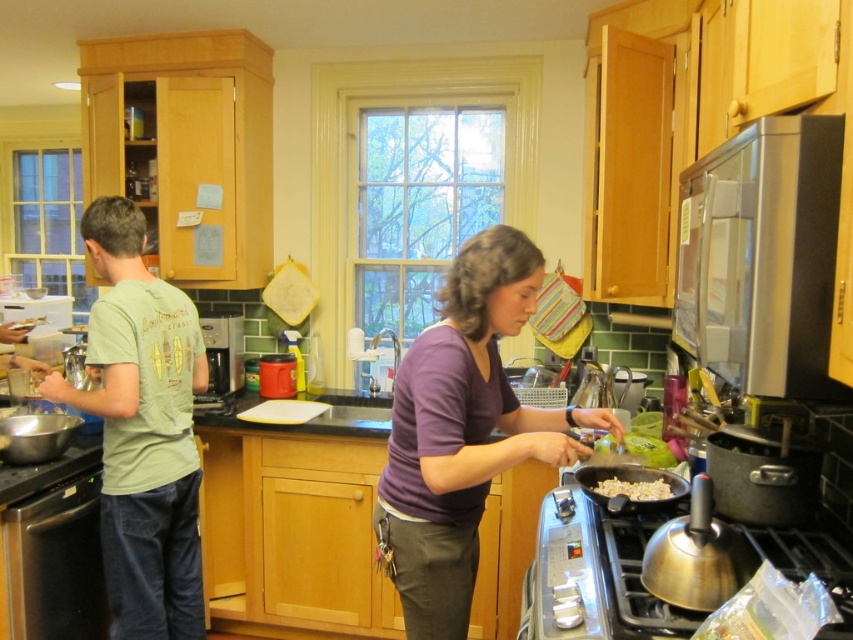
Question: Which object appears farthest from the camera in this image?

Choices:
 (A) brown matte pan at lower center
 (B) green cotton shirt at left
 (C) stainless steel stove at lower right
 (D) purple matte shirt at center

Answer: (B)

Question: Which point is closer to the camera?

Choices:
 (A) (485, 314)
 (B) (589, 602)

Answer: (B)

Question: Is green cotton shirt at left to the right of brown matte pan at lower center from the viewer's perspective?

Choices:
 (A) yes
 (B) no

Answer: (B)

Question: Is satin black dishwasher at lower left below brown matte pan at lower center?

Choices:
 (A) yes
 (B) no

Answer: (A)

Question: Which of the following is the farthest from the observer?

Choices:
 (A) brown matte pan at lower center
 (B) purple matte shirt at center

Answer: (A)

Question: Does stainless steel stove at lower right have a larger size compared to brown matte pan at lower center?

Choices:
 (A) no
 (B) yes

Answer: (B)